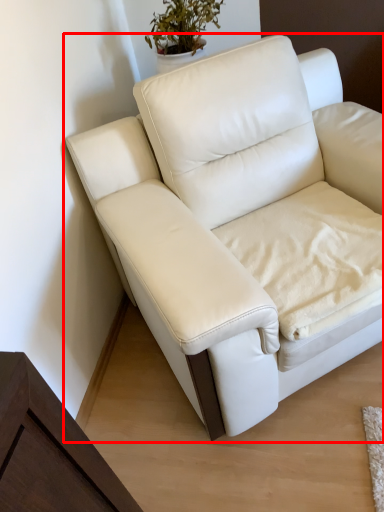
Question: In this image, where is studio couch (annotated by the red box) located relative to sheet?

Choices:
 (A) right
 (B) left

Answer: (B)